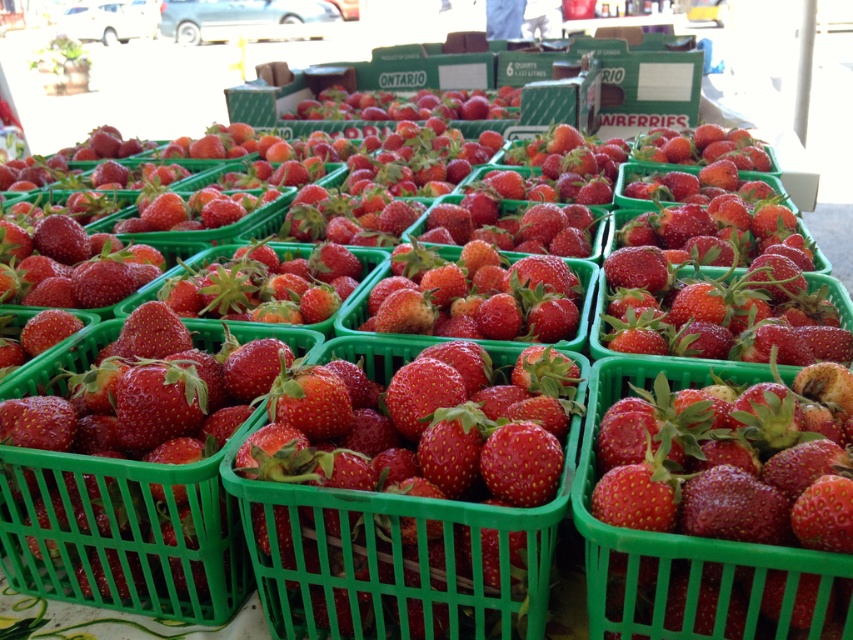
From the picture: Between glossy plastic strawberries at center and glossy plastic basket at center, which one appears on the left side from the viewer's perspective?

glossy plastic basket at center is more to the left.

What do you see at coordinates (399, 557) in the screenshot? I see `glossy plastic strawberries at center` at bounding box center [399, 557].

Where is `glossy plastic strawberries at center`? Image resolution: width=853 pixels, height=640 pixels. glossy plastic strawberries at center is located at coordinates (399, 557).